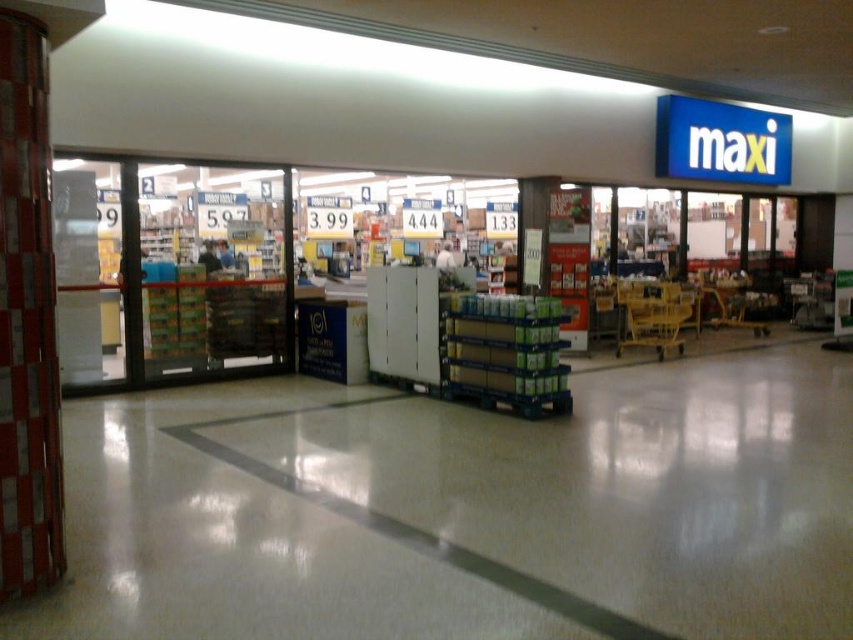
You are a customer at the maxi store, and you need to navigate through the entrance. There is a white plastic shelves at center and a yellow plastic shopping cart at center. Which object is wider, requiring more space to maneuver around?

The white plastic shelves at center might be wider than the yellow plastic shopping cart at center, so it would require more space to maneuver around.

In the scene shown: You are a customer entering the store and see the white plastic shelves at center and the yellow plastic shopping cart at center. Which object is bigger?

The white plastic shelves at center is larger than the yellow plastic shopping cart at center.